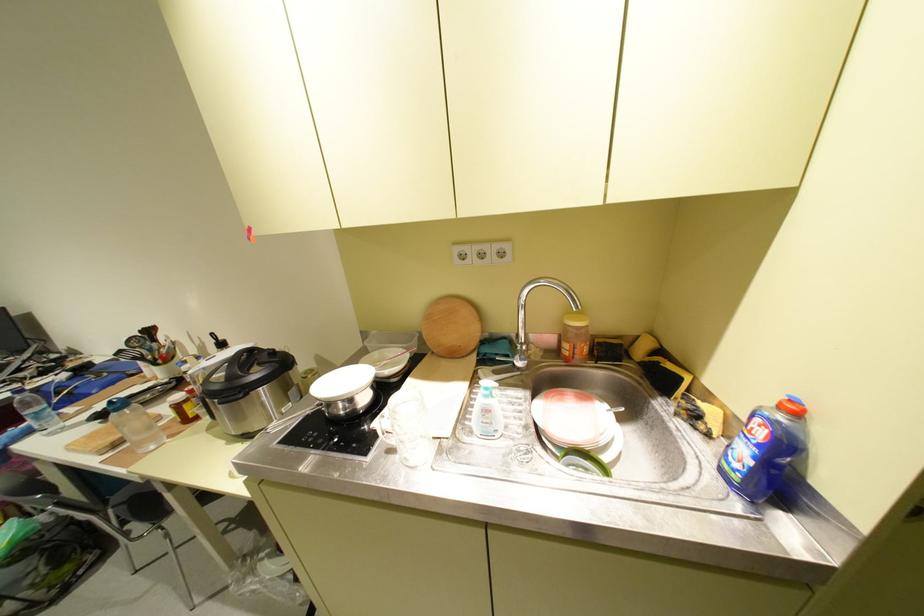
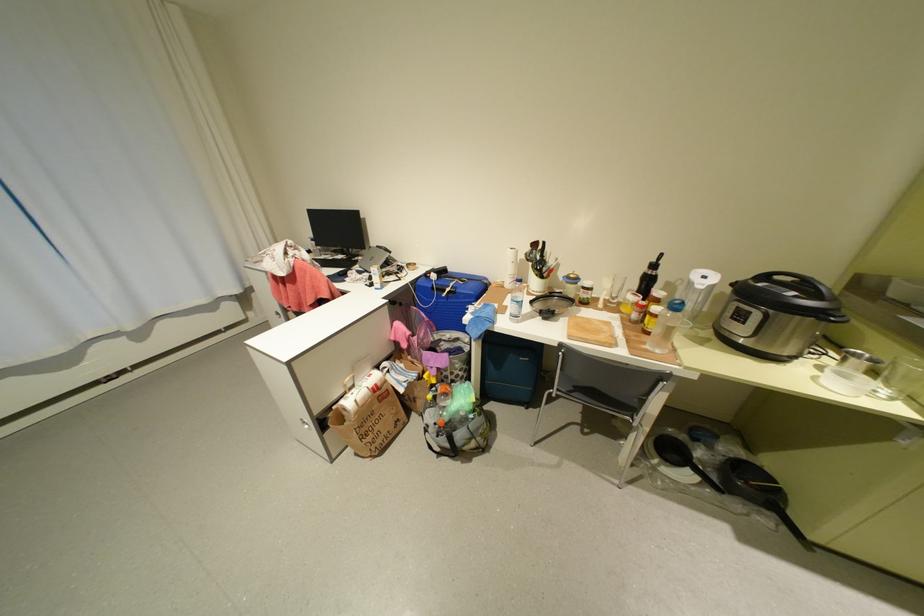
In the second image, find the point that corresponds to point (76, 377) in the first image.

(444, 276)